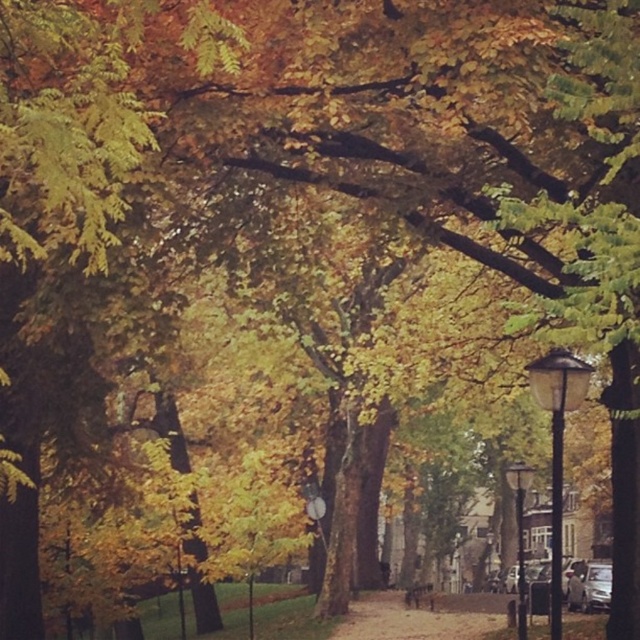
Can you confirm if matte black lamp post at center right is thinner than matte black lamp post at right?

Indeed, matte black lamp post at center right has a lesser width compared to matte black lamp post at right.

Which is in front, point (552, 480) or point (515, 467)?

Point (515, 467) is in front.

Locate an element on the screen. matte black lamp post at center right is located at coordinates (557, 444).